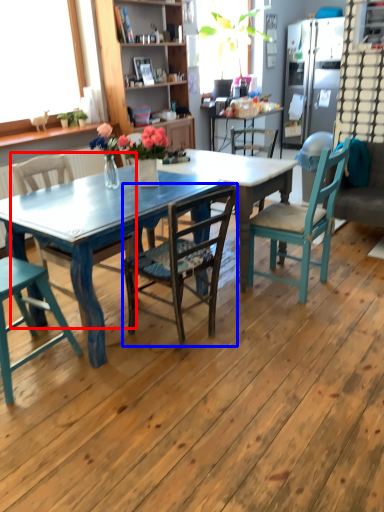
Question: Which object is further to the camera taking this photo, chair (highlighted by a red box) or chair (highlighted by a blue box)?

Choices:
 (A) chair
 (B) chair

Answer: (A)